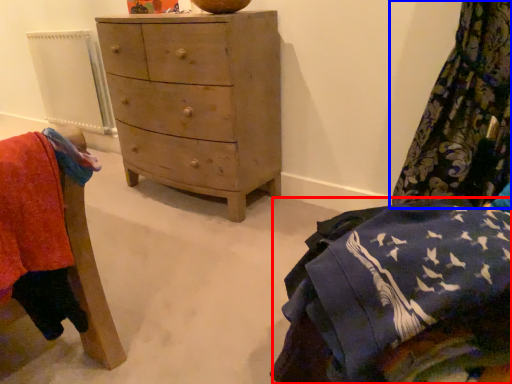
Question: Among these objects, which one is nearest to the camera, clothing (highlighted by a red box) or curtain (highlighted by a blue box)?

Choices:
 (A) clothing
 (B) curtain

Answer: (A)